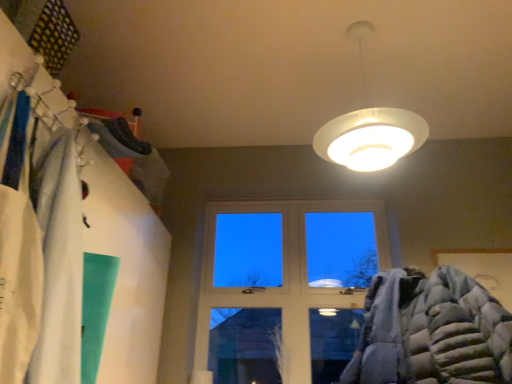
Question: Is point (326, 329) positioned closer to the camera than point (369, 160)?

Choices:
 (A) farther
 (B) closer

Answer: (A)

Question: From a real-world perspective, relative to white glossy lampshade at upper center, is transparent glass window at center vertically above or below?

Choices:
 (A) below
 (B) above

Answer: (A)

Question: In terms of width, does transparent glass window at center look wider or thinner when compared to white glossy lampshade at upper center?

Choices:
 (A) thin
 (B) wide

Answer: (A)

Question: Is white glossy lampshade at upper center bigger or smaller than transparent glass window at center?

Choices:
 (A) big
 (B) small

Answer: (A)

Question: Is white glossy lampshade at upper center to the left or to the right of transparent glass window at center in the image?

Choices:
 (A) left
 (B) right

Answer: (B)

Question: Is white glossy lampshade at upper center inside the boundaries of transparent glass window at center, or outside?

Choices:
 (A) inside
 (B) outside

Answer: (B)

Question: Is white glossy lampshade at upper center taller or shorter than transparent glass window at center?

Choices:
 (A) tall
 (B) short

Answer: (B)